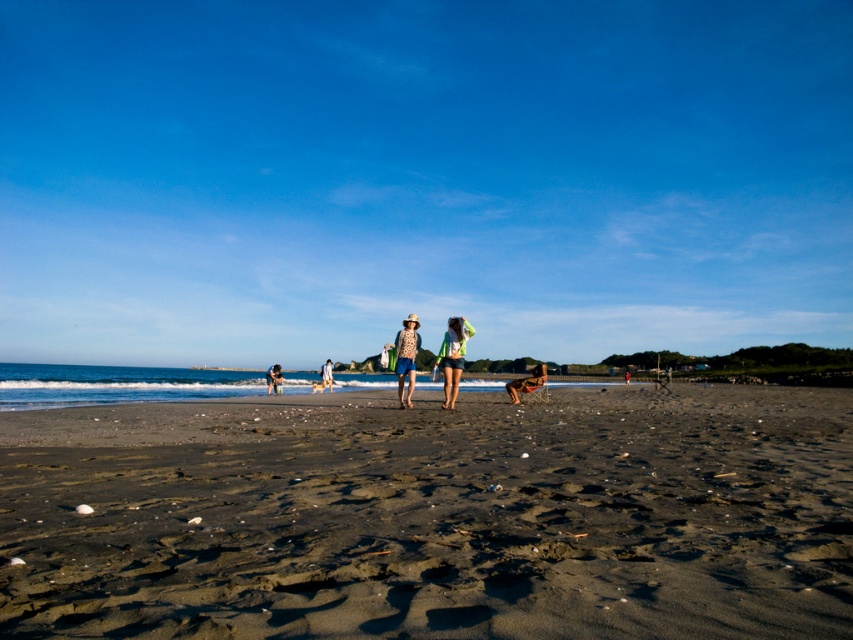
Question: Considering the relative positions of green fabric shorts at center and blue denim shorts at center in the image provided, where is green fabric shorts at center located with respect to blue denim shorts at center?

Choices:
 (A) above
 (B) below

Answer: (A)

Question: Which object is positioned farthest from the patterned fabric shirt at center?

Choices:
 (A) blue denim shorts at center
 (B) green fabric bag at center

Answer: (B)

Question: Among these objects, which one is farthest from the camera?

Choices:
 (A) brown fur dog at center
 (B) blue denim shorts at center

Answer: (B)

Question: Is dark brown sand at center further to camera compared to green fabric shorts at center?

Choices:
 (A) no
 (B) yes

Answer: (A)

Question: Which object is the farthest from the light blue denim shorts at center?

Choices:
 (A) dark brown sand at center
 (B) green fabric shorts at center
 (C) brown fur dog at center

Answer: (A)

Question: Where is dark brown sand at center located in relation to patterned fabric shirt at center in the image?

Choices:
 (A) below
 (B) above

Answer: (A)